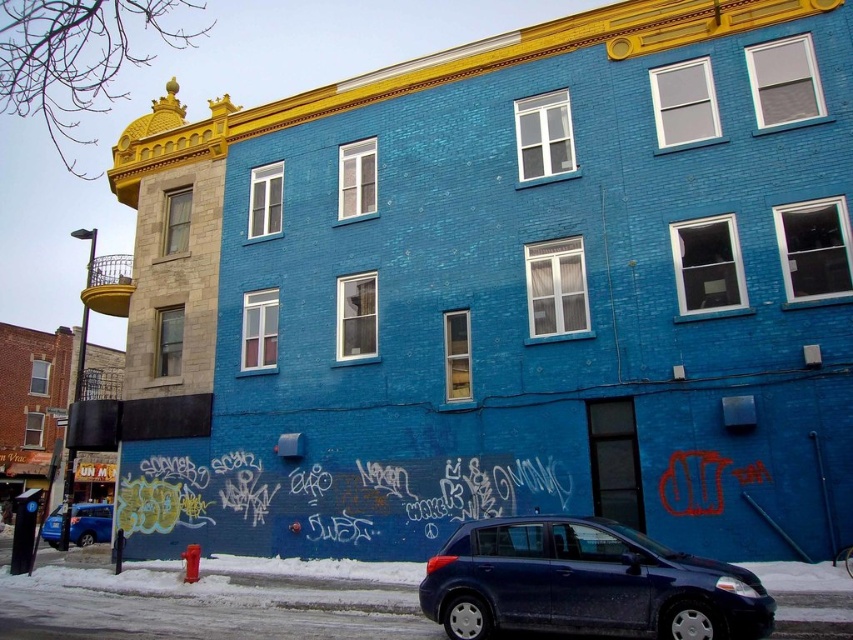
Does satin blue hatchback at lower center have a lesser width compared to matte blue sedan at lower left?

Indeed, satin blue hatchback at lower center has a lesser width compared to matte blue sedan at lower left.

Does satin blue hatchback at lower center have a smaller size compared to matte blue sedan at lower left?

Yes.

Is point (498, 531) less distant than point (111, 520)?

Yes, it is in front of point (111, 520).

This screenshot has height=640, width=853. What are the coordinates of `satin blue hatchback at lower center` in the screenshot? It's located at (585, 582).